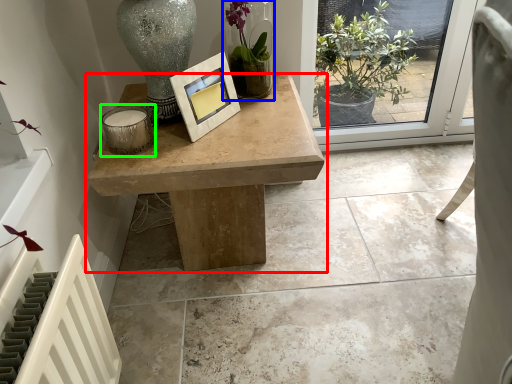
Question: Which object is the closest to the table (highlighted by a red box)? Choose among these: houseplant (highlighted by a blue box) or candle holder (highlighted by a green box).

Choices:
 (A) houseplant
 (B) candle holder

Answer: (B)